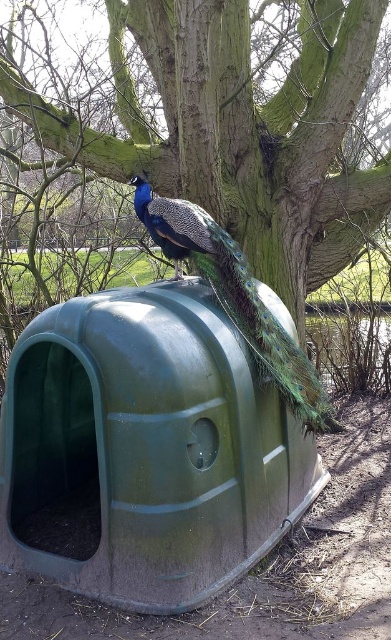
Question: Which point is farther from the camera taking this photo?

Choices:
 (A) (281, 380)
 (B) (127, 74)

Answer: (B)

Question: Among these objects, which one is farthest from the camera?

Choices:
 (A) green plastic tree at upper center
 (B) shiny blue-green peacock at center

Answer: (A)

Question: Does green plastic tree at upper center have a larger size compared to shiny blue-green peacock at center?

Choices:
 (A) yes
 (B) no

Answer: (A)

Question: Can you confirm if green plastic tree at upper center is positioned to the right of shiny blue-green peacock at center?

Choices:
 (A) no
 (B) yes

Answer: (B)

Question: Does green plastic tree at upper center have a greater width compared to shiny blue-green peacock at center?

Choices:
 (A) yes
 (B) no

Answer: (A)